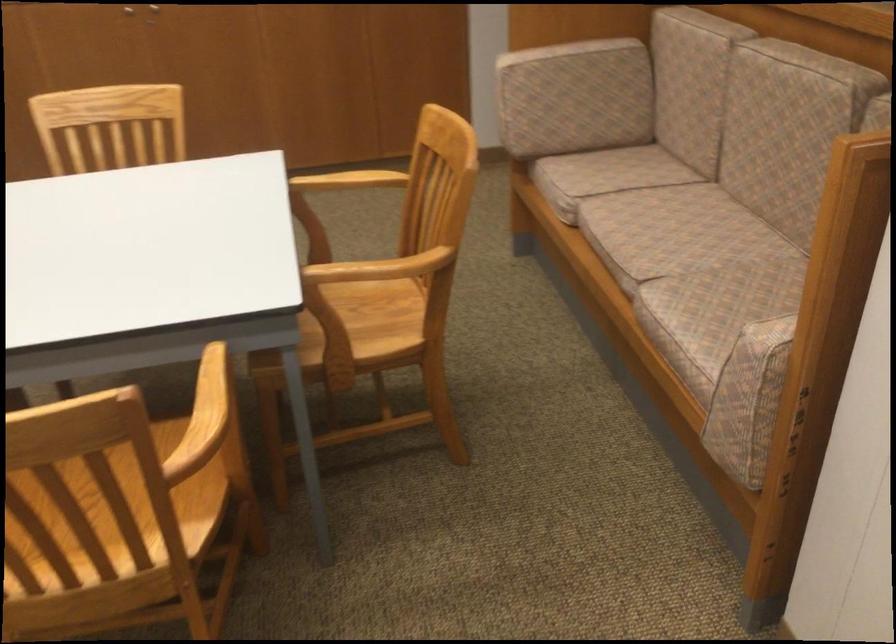
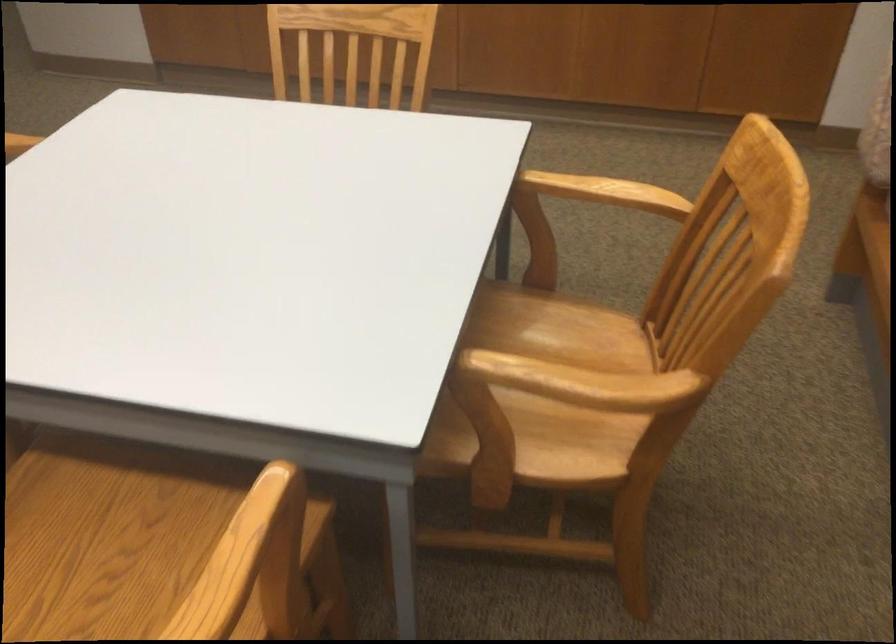
Question: The first image is from the beginning of the video and the second image is from the end. How did the camera likely rotate when shooting the video?

Choices:
 (A) Left
 (B) Right
 (C) Up
 (D) Down

Answer: (A)